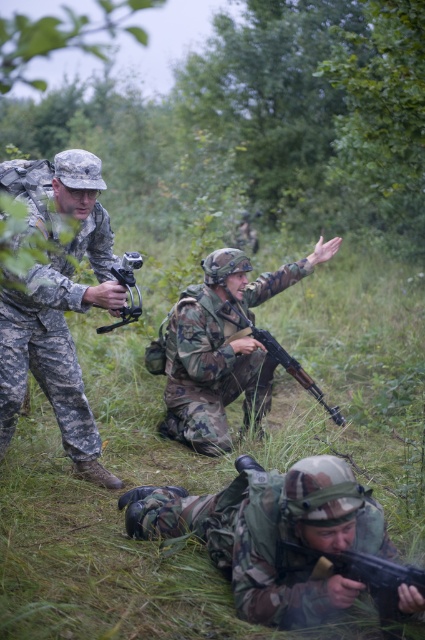
Who is positioned more to the left, camouflage fabric rifle at center or matte black rifle at lower center?

camouflage fabric rifle at center

Who is higher up, camouflage fabric rifle at center or matte black rifle at lower center?

camouflage fabric rifle at center is higher up.

Locate an element on the screen. camouflage fabric rifle at center is located at coordinates (220, 348).

Does point (104, 474) come closer to viewer compared to point (161, 356)?

Yes.

Is camouflage uniform at left positioned at the back of camouflage fabric rifle at center?

No, camouflage uniform at left is closer to the viewer.

Is point (33, 369) closer to camera compared to point (181, 365)?

Yes, point (33, 369) is in front of point (181, 365).

Identify the location of camouflage uniform at left. The width and height of the screenshot is (425, 640). (57, 304).

Is green grass at center in front of camouflage fabric rifle at center?

Yes, it is in front of camouflage fabric rifle at center.

Which of these two, green grass at center or camouflage fabric rifle at center, stands shorter?

camouflage fabric rifle at center

Where is `green grass at center`? The width and height of the screenshot is (425, 640). green grass at center is located at coordinates tap(288, 387).